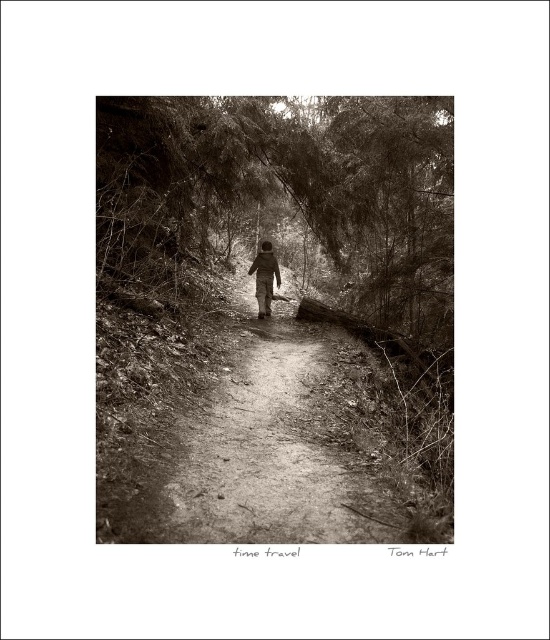
Question: Is sepia textured forest at center to the left of matte black jacket at center from the viewer's perspective?

Choices:
 (A) no
 (B) yes

Answer: (A)

Question: Which point is farther to the camera?

Choices:
 (A) sepia textured forest at center
 (B) matte black jacket at center

Answer: (B)

Question: Does sepia textured forest at center have a lesser width compared to matte black jacket at center?

Choices:
 (A) yes
 (B) no

Answer: (B)

Question: Does sepia textured forest at center come in front of matte black jacket at center?

Choices:
 (A) no
 (B) yes

Answer: (B)